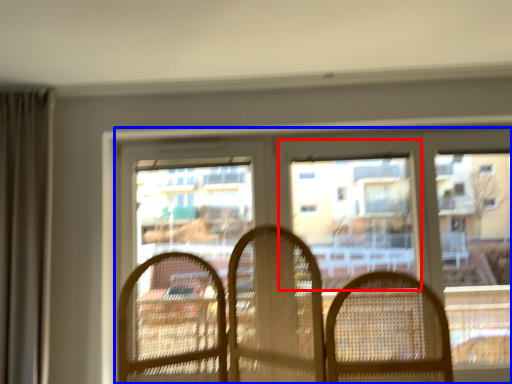
Question: Which point is closer to the camera, window screen (highlighted by a red box) or window (highlighted by a blue box)?

Choices:
 (A) window screen
 (B) window

Answer: (B)